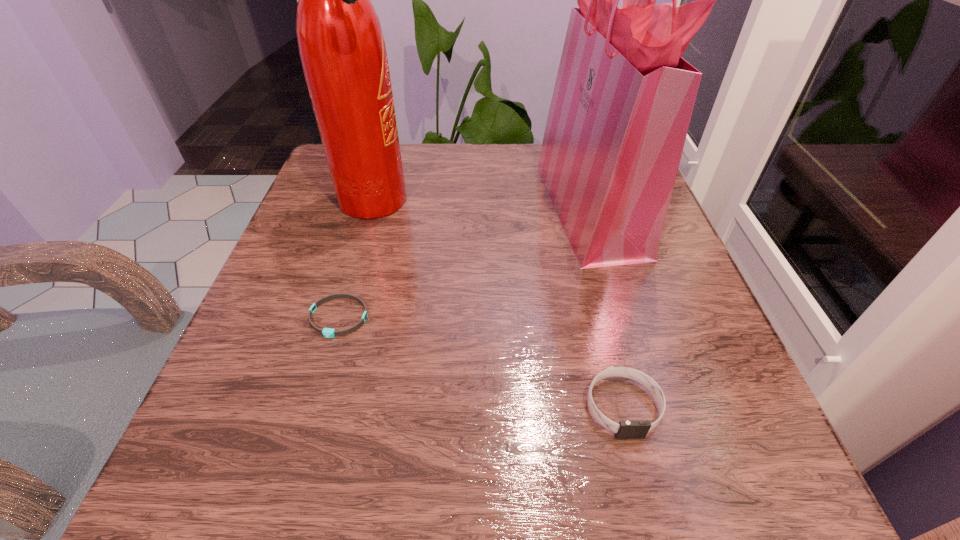
At what (x,y) coordinates should I click in order to perform the action: click on vacant space at the far edge of the desktop. Please return your answer as a coordinate pair (x, y). This screenshot has width=960, height=540. Looking at the image, I should click on (524, 167).

Identify the location of vacant area at the near edge of the desktop. The image size is (960, 540). (502, 447).

Find the location of a particular element. This screenshot has height=540, width=960. vacant space at the left edge is located at coordinates (237, 389).

Find the location of a particular element. This screenshot has height=540, width=960. vacant region at the near left corner is located at coordinates (248, 436).

Where is `free space between the nearest object and the shopping bag`? free space between the nearest object and the shopping bag is located at coordinates (607, 306).

Where is `vacant area that lies between the shortest object and the shopping bag`? vacant area that lies between the shortest object and the shopping bag is located at coordinates (464, 261).

Locate an element on the screen. Image resolution: width=960 pixels, height=540 pixels. empty location between the shopping bag and the farther wristband is located at coordinates (464, 261).

Find the location of a particular element. The width and height of the screenshot is (960, 540). empty space between the second nearest object and the second shortest object is located at coordinates (481, 362).

Identify the location of unoccupied position between the farther wristband and the fire extinguisher. This screenshot has height=540, width=960. (355, 260).

Identify the location of free space between the fire extinguisher and the shortest object. pyautogui.click(x=355, y=260).